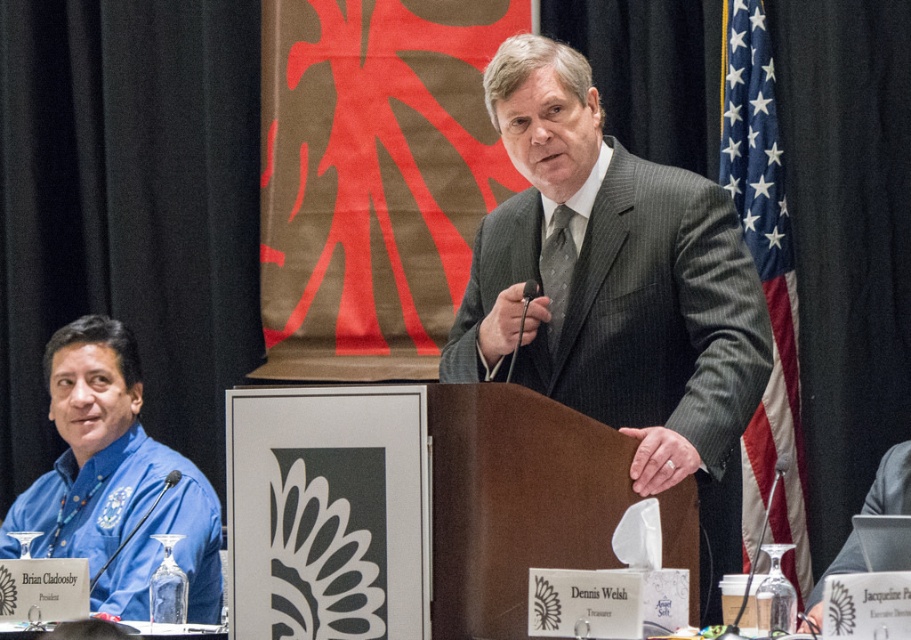
Question: Among these points, which one is farthest from the camera?

Choices:
 (A) (795, 419)
 (B) (548, 280)
 (C) (577, 218)

Answer: (A)

Question: Observing the image, what is the correct spatial positioning of blue fabric shirt at left in reference to pinstriped fabric tie at center?

Choices:
 (A) below
 (B) above

Answer: (A)

Question: In this image, where is blue fabric shirt at left located relative to american flag at right?

Choices:
 (A) above
 (B) below

Answer: (B)

Question: Which point is closer to the camera?

Choices:
 (A) (554, 224)
 (B) (797, 588)
 (C) (52, 540)

Answer: (A)

Question: Does blue fabric shirt at left appear on the left side of american flag at right?

Choices:
 (A) no
 (B) yes

Answer: (B)

Question: Based on their relative distances, which object is farther from the gray pinstripe suit at center?

Choices:
 (A) pinstriped fabric tie at center
 (B) blue fabric shirt at left

Answer: (B)